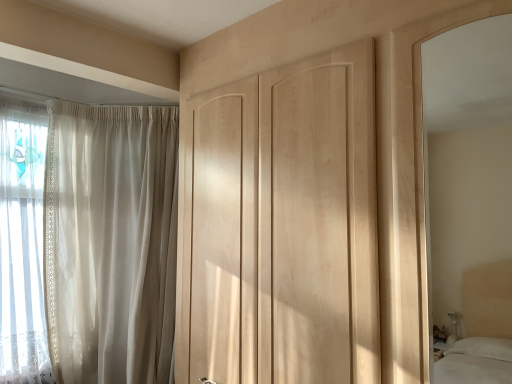
Question: Looking at the image, does sheer white curtain at left seem bigger or smaller compared to light wood/matte mirror at right?

Choices:
 (A) big
 (B) small

Answer: (A)

Question: Is sheer white curtain at left to the left or to the right of light wood/matte mirror at right in the image?

Choices:
 (A) right
 (B) left

Answer: (B)

Question: Which object is positioned closest to the natural wood door at center?

Choices:
 (A) sheer white curtain at left
 (B) light wood/matte mirror at right

Answer: (A)

Question: Considering the real-world distances, which object is farthest from the light wood/matte mirror at right?

Choices:
 (A) natural wood door at center
 (B) sheer white curtain at left

Answer: (B)